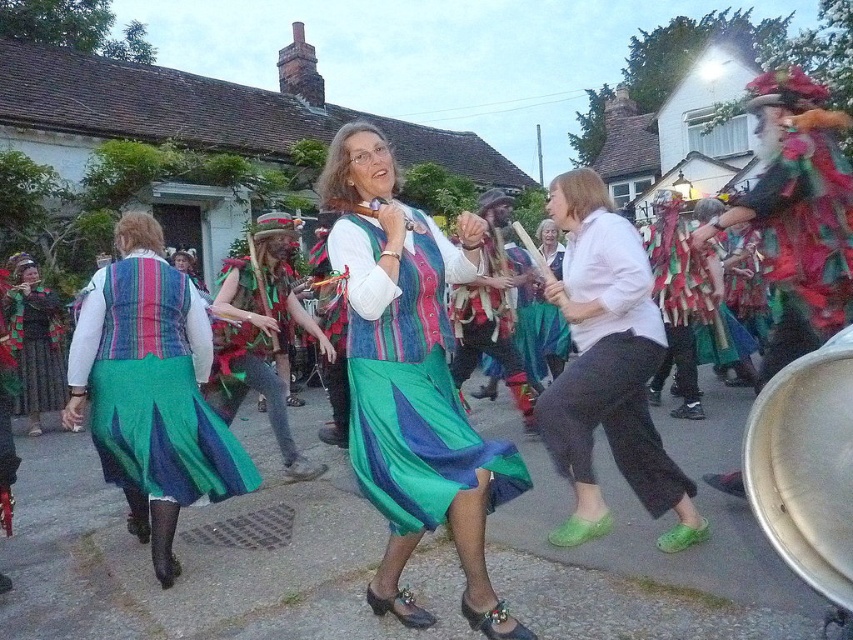
You are a photographer standing at the edge of the village street. You want to capture a photo that includes both the matte multicolored dress at center and the velvet green robe at right. Given that your camera has a maximum focus range of 5 feet, will you be able to get both subjects in focus?

The matte multicolored dress at center and the velvet green robe at right are 5.61 feet apart from each other. Since the distance between them exceeds the camera maximum focus range of 5 feet, you will not be able to get both subjects in focus.

You are a photographer standing at the edge of the village street. You want to take a photo of the denim vest at center and the chimney of the old stone house. How far apart are these two objects in meters?

The denim vest at center and the chimney of the old stone house are 3.34 meters apart.

You are a photographer trying to capture the Morris dance. You want to ensure the denim vest at center and the velvet green robe at right are both visible in your photo. Based on their positions, which one is closer to the camera?

The denim vest at center is closer to the camera because the velvet green robe at right is behind it.